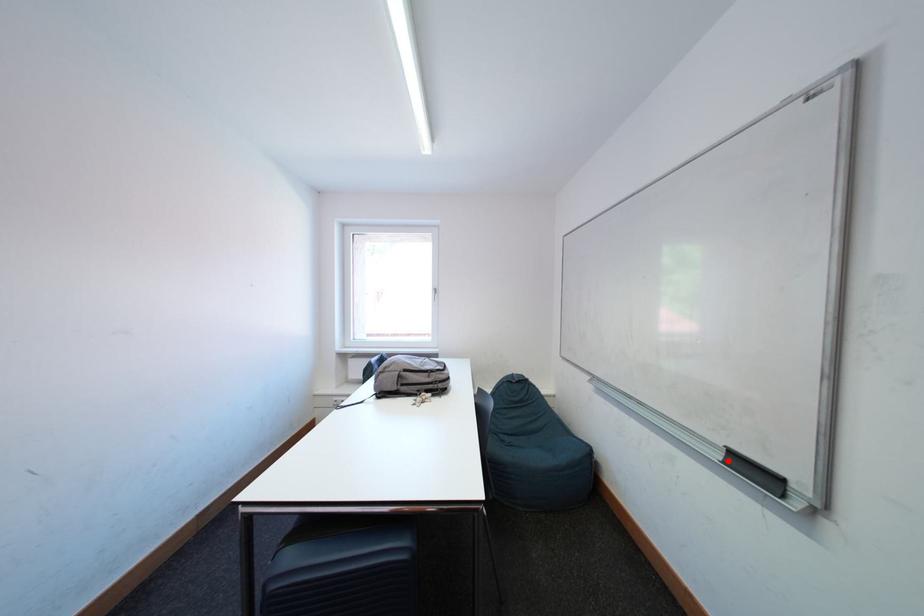
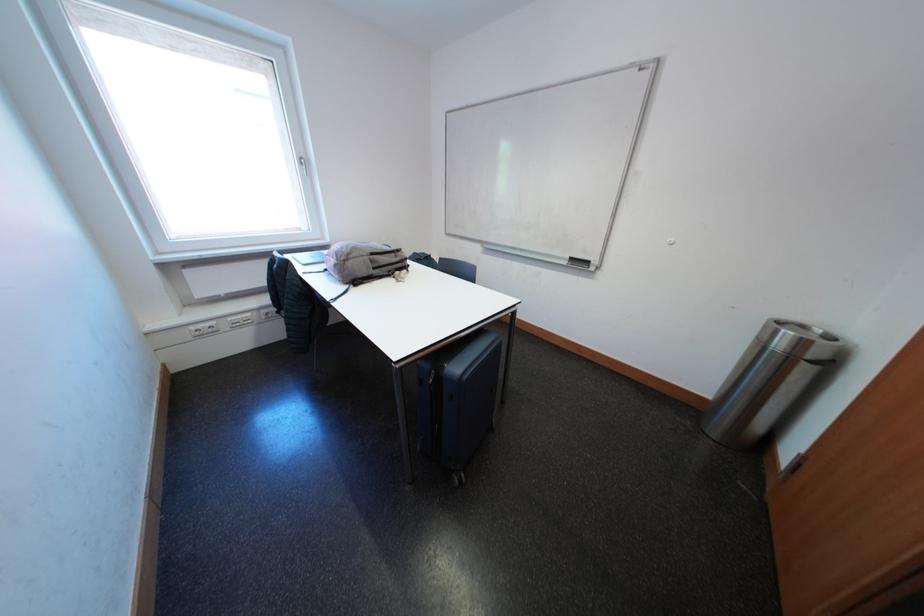
The point at the highlighted location is marked in the first image. Where is the corresponding point in the second image?

(575, 267)